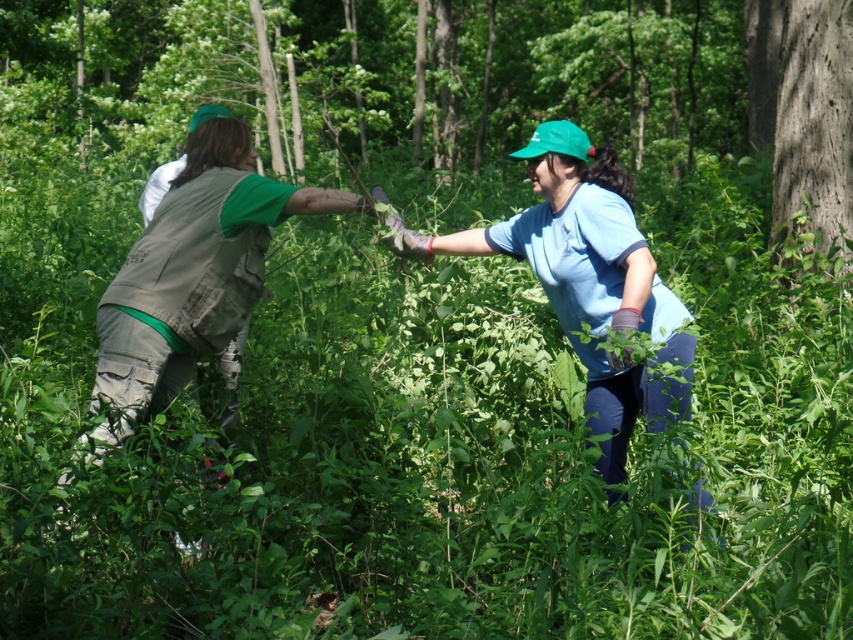
Is blue cotton shirt at center taller than smooth brown bark at right?

Incorrect, blue cotton shirt at center's height is not larger of smooth brown bark at right's.

Is blue cotton shirt at center to the left of smooth brown bark at right from the viewer's perspective?

Yes, blue cotton shirt at center is to the left of smooth brown bark at right.

I want to click on blue cotton shirt at center, so click(x=587, y=280).

Who is taller, green fabric vest at center or smooth brown bark at right?

Standing taller between the two is smooth brown bark at right.

This screenshot has width=853, height=640. What do you see at coordinates (584, 280) in the screenshot?
I see `green fabric vest at center` at bounding box center [584, 280].

The width and height of the screenshot is (853, 640). Identify the location of green fabric vest at center. (584, 280).

Can you confirm if green fabric vest at center is smaller than blue cotton shirt at center?

No, green fabric vest at center is not smaller than blue cotton shirt at center.

Can you confirm if green fabric vest at center is bigger than blue cotton shirt at center?

Answer: Yes, green fabric vest at center is bigger than blue cotton shirt at center.

Does point (619, 364) lie in front of point (610, 298)?

Yes, point (619, 364) is closer to viewer.

Find the location of a particular element. green fabric vest at center is located at coordinates (584, 280).